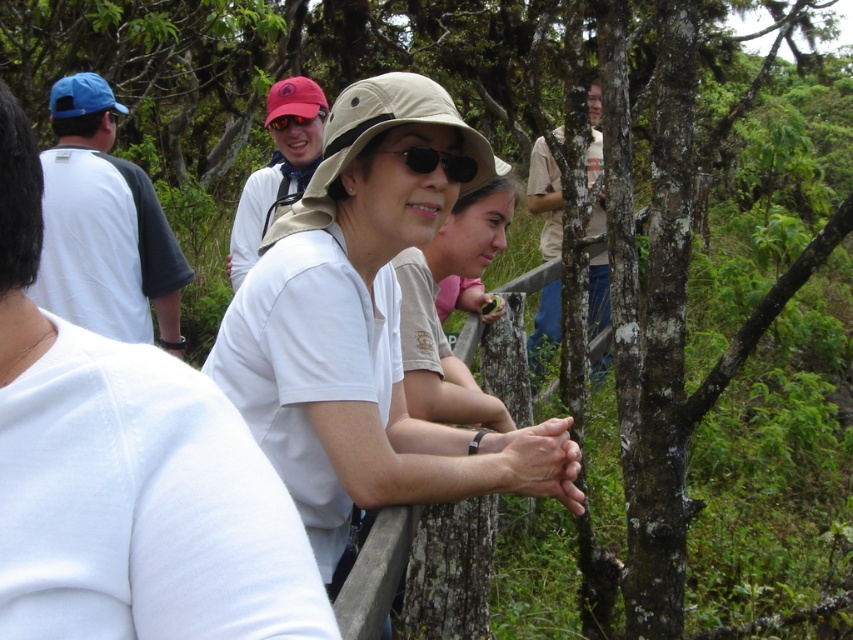
You are a photographer trying to capture a candid shot of the matte white shirt at upper center and the black matte sunglasses at center. Since you want to include both in the frame, which object should you position closer to the left side of your camera viewfinder?

The matte white shirt at upper center is to the left of the black matte sunglasses at center, so to include both in the frame, position the matte white shirt at upper center closer to the left side of your camera viewfinder.